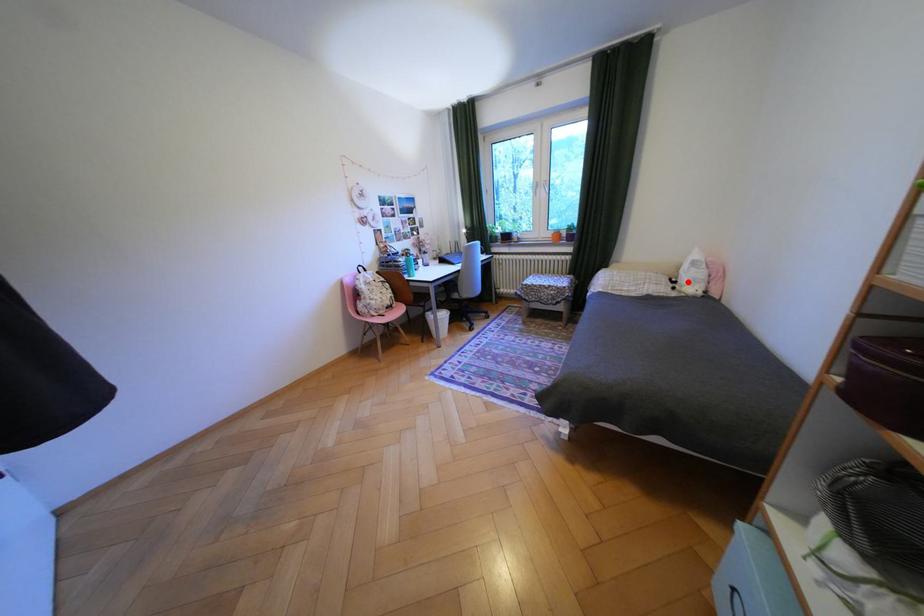
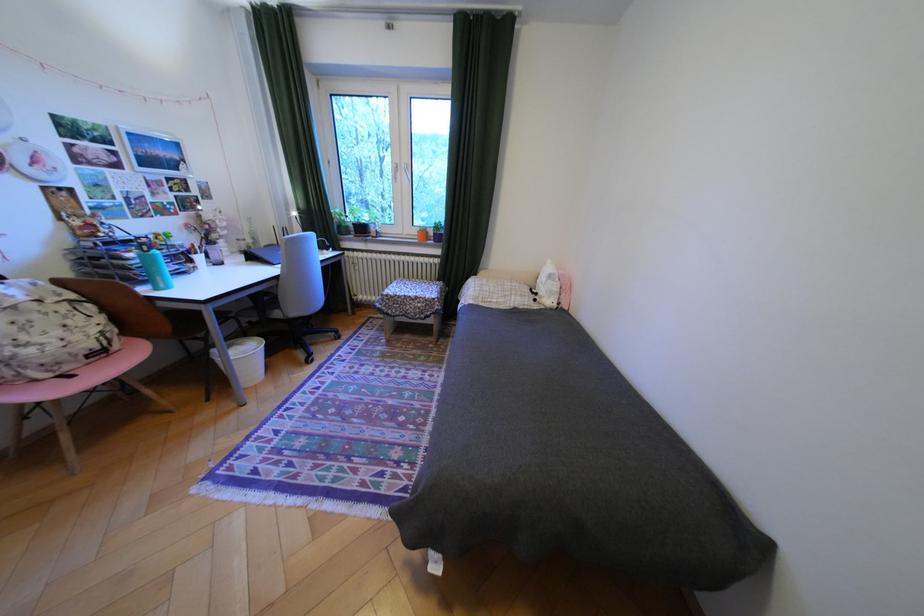
Locate, in the second image, the point that corresponds to the highlighted location in the first image.

(548, 294)